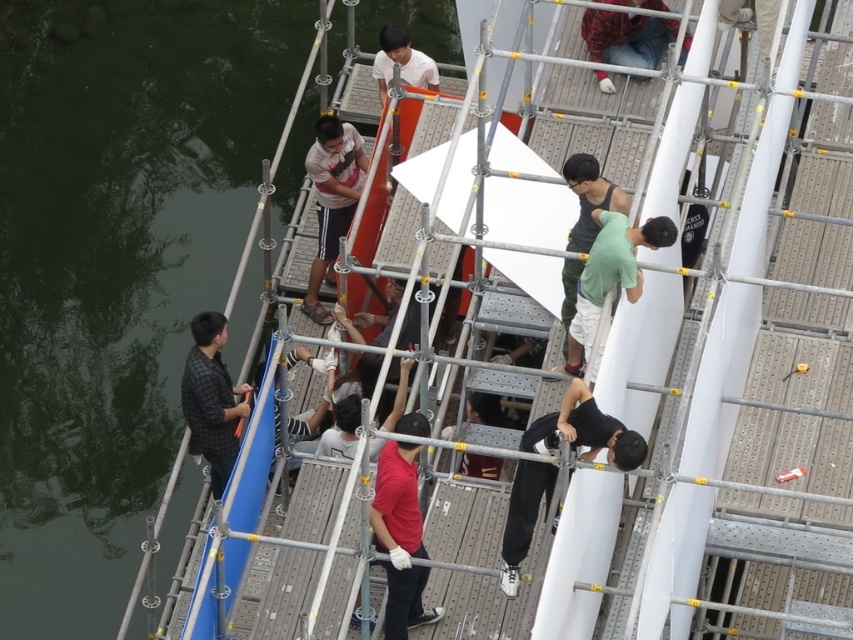
You are standing in front of the scaffolding structure. There are two points marked on the image at coordinates point [387,504] and point [426,86]. Which point is closer to your viewpoint?

Point [387,504] is closer to the camera than point [426,86], so the point closer to your viewpoint is point [387,504].